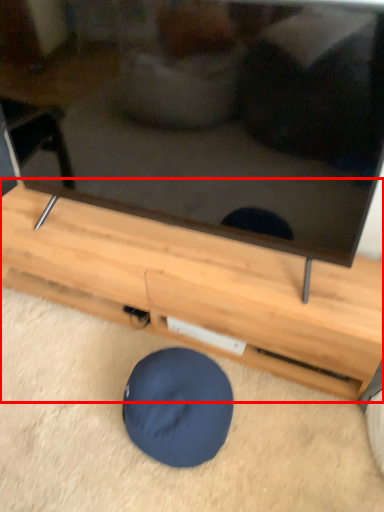
Question: From the image's perspective, where is furniture (annotated by the red box) located relative to dog bed?

Choices:
 (A) above
 (B) below

Answer: (A)